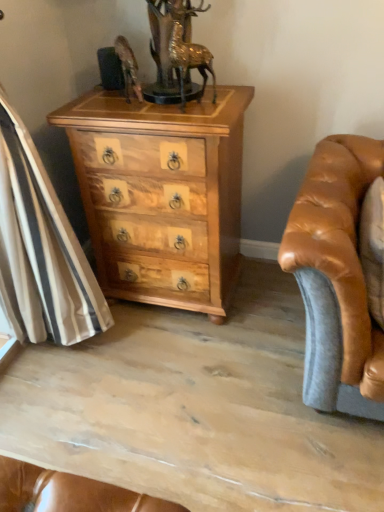
Where is `free space in front of gold metallic deer at upper center`? free space in front of gold metallic deer at upper center is located at coordinates (198, 117).